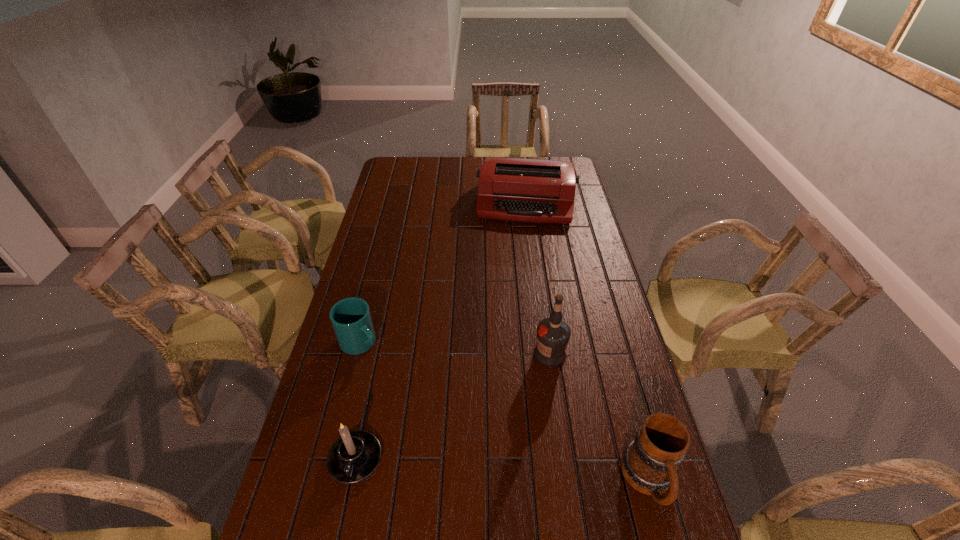
At what (x,y) coordinates should I click in order to perform the action: click on empty space that is in between the farthest object and the vodka. Please return your answer as a coordinate pair (x, y). Looking at the image, I should click on (539, 278).

Locate an element on the screen. This screenshot has height=540, width=960. free point between the cup and the farthest object is located at coordinates (444, 273).

This screenshot has width=960, height=540. I want to click on free area in between the vodka and the candle holder, so click(452, 407).

Locate an element on the screen. The width and height of the screenshot is (960, 540). vacant region between the candle holder and the mug is located at coordinates (502, 470).

This screenshot has width=960, height=540. Find the location of `empty space between the farthest object and the mug`. empty space between the farthest object and the mug is located at coordinates (588, 342).

What are the coordinates of `empty space that is in between the typewriter and the cup` in the screenshot? It's located at (444, 273).

At what (x,y) coordinates should I click in order to perform the action: click on object that is the nearest to the farthest object. Please return your answer as a coordinate pair (x, y). Image resolution: width=960 pixels, height=540 pixels. Looking at the image, I should click on (553, 334).

Locate which object ranks fourth in proximity to the cup. Please provide its 2D coordinates. Your answer should be formatted as a tuple, i.e. [(x, y)], where the tuple contains the x and y coordinates of a point satisfying the conditions above.

[(649, 463)]

You are a GUI agent. You are given a task and a screenshot of the screen. Output one action in this format:
    pyautogui.click(x=<x>, y=<y>)
    Task: Click on the vacant region that satisfies the following two spatial constraints: 1. on the back side of the cup; 2. on the right side of the farthest object
    This screenshot has width=960, height=540.
    Given the screenshot: What is the action you would take?
    pyautogui.click(x=396, y=202)